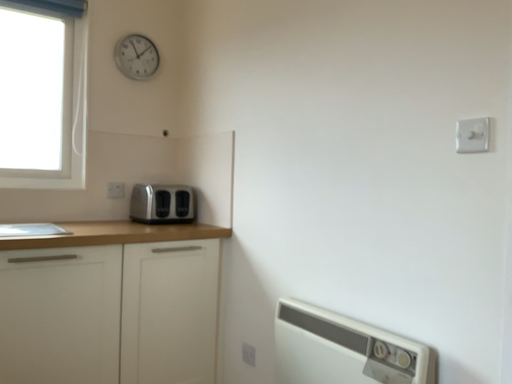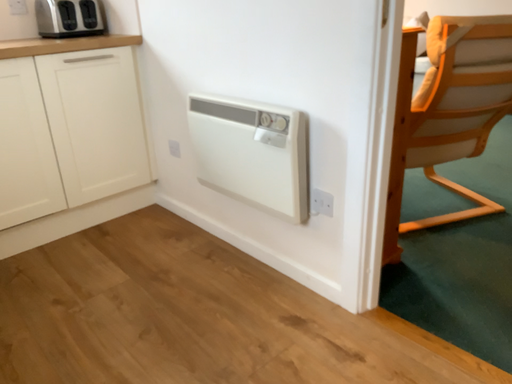
Question: How did the camera likely rotate when shooting the video?

Choices:
 (A) rotated upward
 (B) rotated downward

Answer: (B)